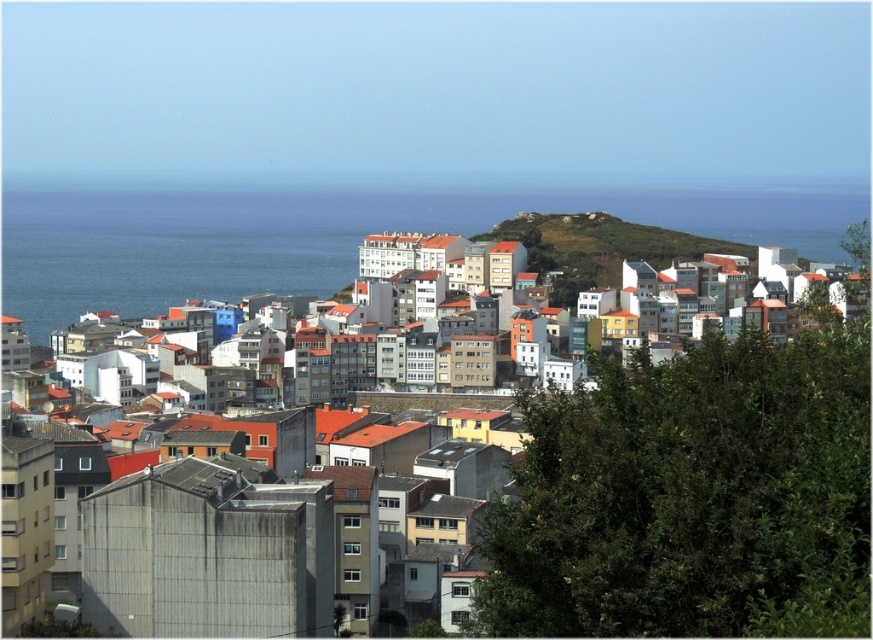
Can you confirm if white matte building at center is positioned above green grassy hillside at center?

Incorrect, white matte building at center is not positioned above green grassy hillside at center.

Who is more forward, [610,618] or [619,230]?

Positioned in front is point [610,618].

Find the location of a particular element. This screenshot has height=640, width=873. white matte building at center is located at coordinates click(693, 497).

Who is more forward, (187, 291) or (676, 246)?

Positioned in front is point (676, 246).

Can you confirm if blue water at center is positioned below green grassy hillside at center?

Yes, blue water at center is below green grassy hillside at center.

The width and height of the screenshot is (873, 640). I want to click on blue water at center, so click(321, 237).

At what (x,y) coordinates should I click in order to perform the action: click on blue water at center. Please return your answer as a coordinate pair (x, y). The height and width of the screenshot is (640, 873). Looking at the image, I should click on [x=321, y=237].

Between white matte building at center and blue water at center, which one appears on the right side from the viewer's perspective?

white matte building at center is more to the right.

Can you confirm if white matte building at center is shorter than blue water at center?

In fact, white matte building at center may be taller than blue water at center.

Who is more distant from viewer, (607, 380) or (198, 218)?

Point (198, 218)

This screenshot has height=640, width=873. I want to click on white matte building at center, so click(693, 497).